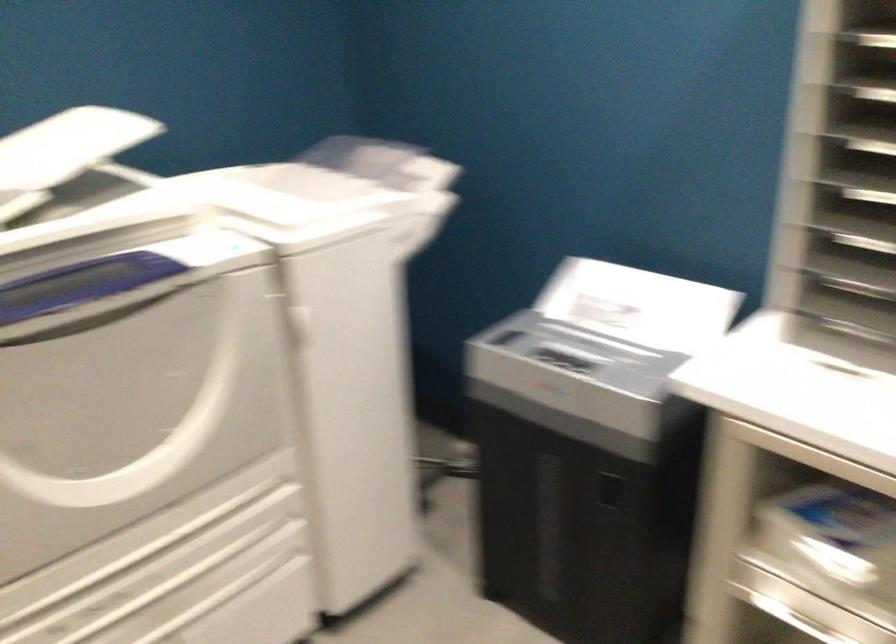
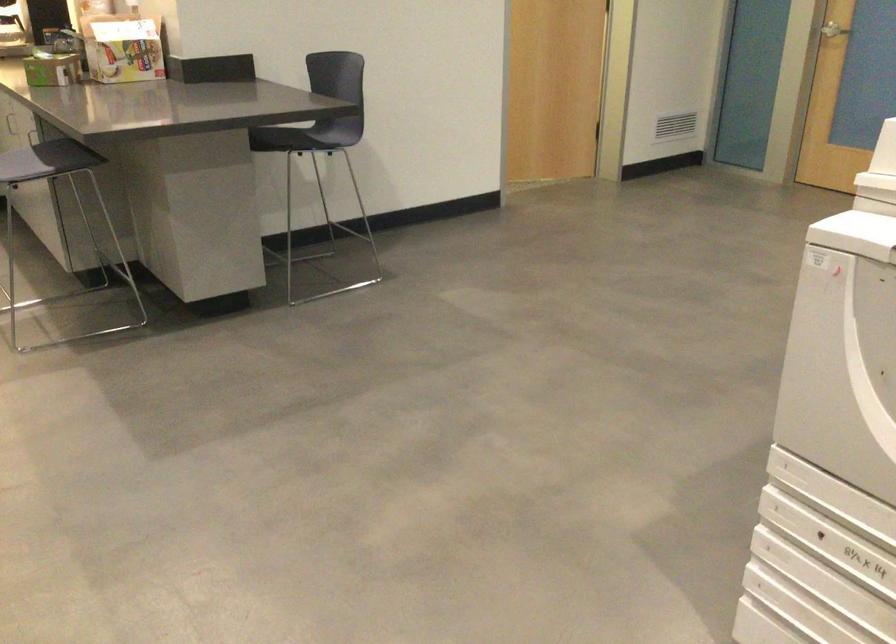
Based on the photo, the images are taken continuously from a first-person perspective. In which direction is your viewpoint rotating?

The camera rotated toward left-down.